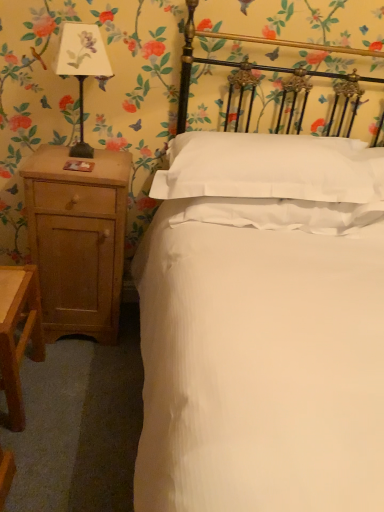
What is the approximate height of white smooth pillow at center?

white smooth pillow at center is 10.13 inches tall.

In order to click on white satin bed at center in this screenshot , I will do `click(263, 326)`.

Measure the distance between point (60, 66) and camera.

Point (60, 66) and camera are 4.88 feet apart from each other.

What are the coordinates of `white smooth pillow at center` in the screenshot? It's located at (271, 168).

Considering the sizes of objects matte black lampshade at left and white smooth pillow at center in the image provided, who is wider, matte black lampshade at left or white smooth pillow at center?

white smooth pillow at center is wider.

Considering the positions of point (78, 78) and point (313, 165), is point (78, 78) closer or farther from the camera than point (313, 165)?

Point (78, 78) is positioned farther from the camera compared to point (313, 165).

Where is `pillow located underneath the matte black lampshade at left (from a real-world perspective)`? pillow located underneath the matte black lampshade at left (from a real-world perspective) is located at coordinates (271, 168).

Which is more to the left, matte black lampshade at left or white smooth pillow at center?

matte black lampshade at left.

From the picture: How much distance is there between matte black lampshade at left and light brown wood nightstand at left?

matte black lampshade at left and light brown wood nightstand at left are 14.06 inches apart from each other.

How different are the orientations of matte black lampshade at left and light brown wood nightstand at left in degrees?

3.87 degrees separate the facing orientations of matte black lampshade at left and light brown wood nightstand at left.

In the scene shown: Is matte black lampshade at left turned away from light brown wood nightstand at left?

matte black lampshade at left does not have its back to light brown wood nightstand at left.

Is matte black lampshade at left not within light brown wood nightstand at left?

matte black lampshade at left lies outside light brown wood nightstand at left's area.

Based on the photo, from the image's perspective, which one is positioned lower, light brown wood nightstand at left or white satin bed at center?

From the image's view, white satin bed at center is below.

Is light brown wood nightstand at left located outside white satin bed at center?

Yes.

The width and height of the screenshot is (384, 512). In order to click on bed below the light brown wood nightstand at left (from the image's perspective) in this screenshot , I will do `click(263, 326)`.

Is point (111, 291) positioned after point (282, 248)?

Yes, it is.

Is light brown wood nightstand at left oriented away from white smooth pillow at center?

No, light brown wood nightstand at left is not facing away from white smooth pillow at center.

Can you confirm if light brown wood nightstand at left is bigger than white smooth pillow at center?

Actually, light brown wood nightstand at left might be smaller than white smooth pillow at center.

Which object is closer to the camera taking this photo, light brown wood nightstand at left or white smooth pillow at center?

white smooth pillow at center is more forward.

Considering the sizes of light brown wood nightstand at left and white smooth pillow at center in the image, is light brown wood nightstand at left taller or shorter than white smooth pillow at center?

Considering their sizes, light brown wood nightstand at left has more height than white smooth pillow at center.

Measure the distance from white smooth pillow at center to matte black lampshade at left.

white smooth pillow at center is 23.38 inches from matte black lampshade at left.

Does white smooth pillow at center turn towards matte black lampshade at left?

No.

Does point (254, 170) come behind point (98, 67)?

Yes, it is behind point (98, 67).

Would you say white smooth pillow at center is part of white satin bed at center's contents?

Yes, white smooth pillow at center can be found within white satin bed at center.

Who is shorter, white satin bed at center or white smooth pillow at center?

white smooth pillow at center is shorter.

Between white satin bed at center and white smooth pillow at center, which one has larger size?

white satin bed at center.

Considering the sizes of objects matte black lampshade at left and white satin bed at center in the image provided, who is bigger, matte black lampshade at left or white satin bed at center?

white satin bed at center.

Between matte black lampshade at left and white satin bed at center, which one has larger width?

Wider between the two is white satin bed at center.

Based on the photo, from a real-world perspective, between matte black lampshade at left and white satin bed at center, who is vertically higher?

matte black lampshade at left.

At what (x,y) coordinates should I click in order to perform the action: click on bedside lamp behind the white smooth pillow at center. Please return your answer as a coordinate pair (x, y). Looking at the image, I should click on (82, 67).

The height and width of the screenshot is (512, 384). I want to click on nightstand on the left of matte black lampshade at left, so pyautogui.click(x=78, y=240).

In the scene shown: Looking at the image, which one is located further to white satin bed at center, light brown wood nightstand at left or white smooth pillow at center?

light brown wood nightstand at left lies further to white satin bed at center than the other object.

Considering their positions, is white satin bed at center positioned further to light brown wood nightstand at left than white smooth pillow at center?

Among the two, white satin bed at center is located further to light brown wood nightstand at left.

Estimate the real-world distances between objects in this image. Which object is closer to matte black lampshade at left, light brown wood nightstand at left or white satin bed at center?

Based on the image, light brown wood nightstand at left appears to be nearer to matte black lampshade at left.

Looking at the image, which one is located further to white satin bed at center, matte black lampshade at left or light brown wood nightstand at left?

Among the two, matte black lampshade at left is located further to white satin bed at center.

Which object lies nearer to the anchor point matte black lampshade at left, light brown wood nightstand at left or white smooth pillow at center?

light brown wood nightstand at left is closer to matte black lampshade at left.

From the image, which object appears to be farther from white smooth pillow at center, light brown wood nightstand at left or white satin bed at center?

light brown wood nightstand at left is further to white smooth pillow at center.

Estimate the real-world distances between objects in this image. Which object is closer to white satin bed at center, white smooth pillow at center or light brown wood nightstand at left?

white smooth pillow at center is positioned closer to the anchor white satin bed at center.

When comparing their distances from light brown wood nightstand at left, does white smooth pillow at center or matte black lampshade at left seem further?

white smooth pillow at center.

Identify the location of pillow between white satin bed at center and matte black lampshade at left from front to back. (271, 168).

Identify the location of bedside lamp between white satin bed at center and light brown wood nightstand at left from front to back. (82, 67).

The height and width of the screenshot is (512, 384). In order to click on pillow between white satin bed at center and light brown wood nightstand at left in the front-back direction in this screenshot , I will do `click(271, 168)`.

The width and height of the screenshot is (384, 512). What are the coordinates of `bedside lamp between light brown wood nightstand at left and white smooth pillow at center in the horizontal direction` in the screenshot? It's located at (82, 67).